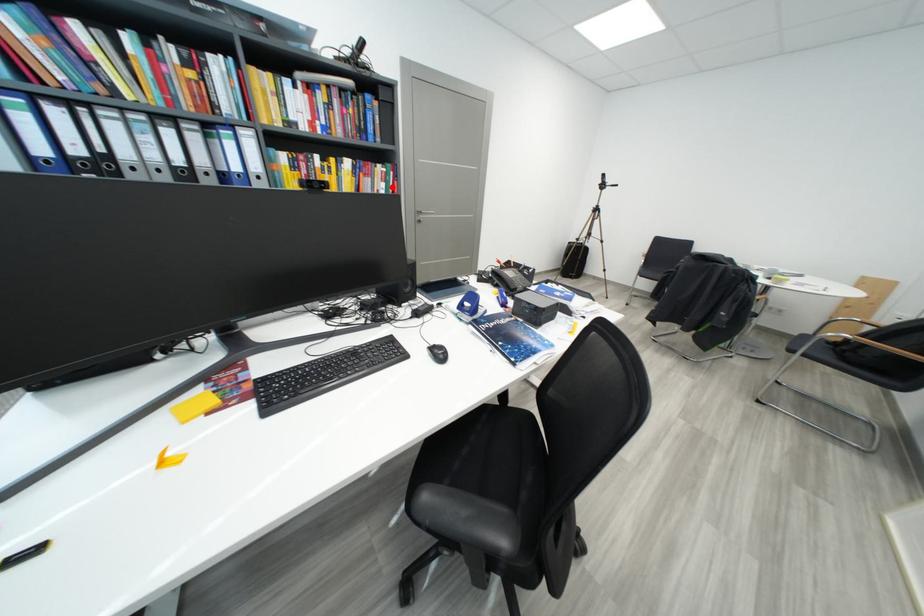
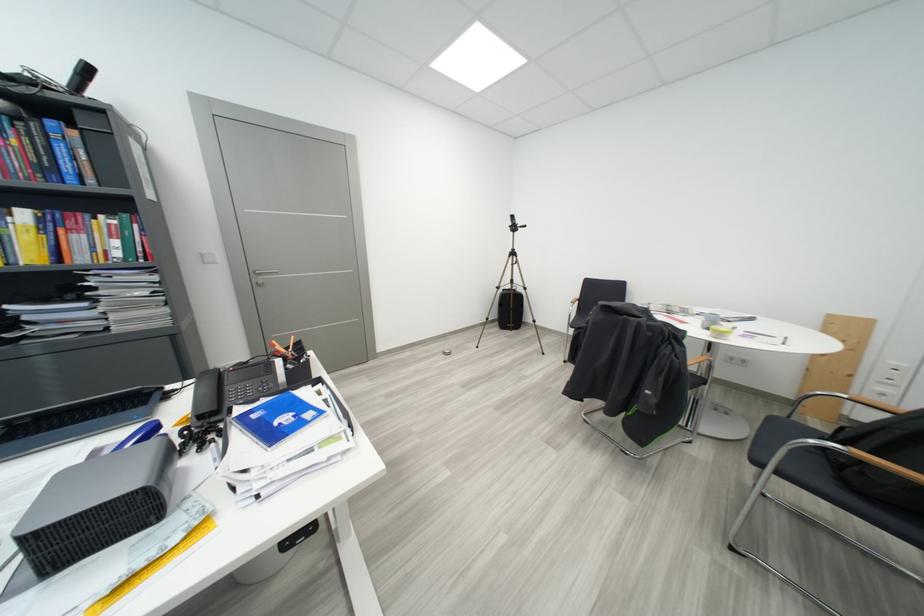
Question: I am providing you with two images of the same scene from different viewpoints. Given a red point in image1, look at the same physical point in image2. Is it:

Choices:
 (A) Closer to the viewpoint
 (B) Farther from the viewpoint

Answer: (B)